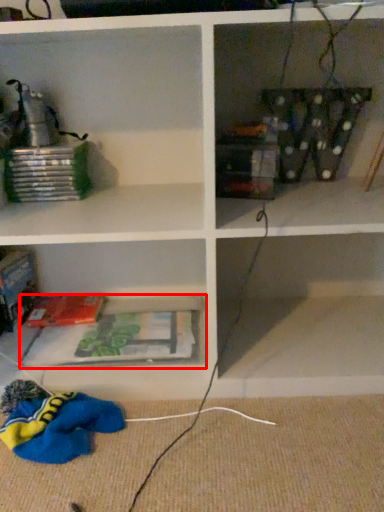
Question: Observing the image, what is the correct spatial positioning of cabinet (annotated by the red box) in reference to paperback book?

Choices:
 (A) left
 (B) right

Answer: (B)